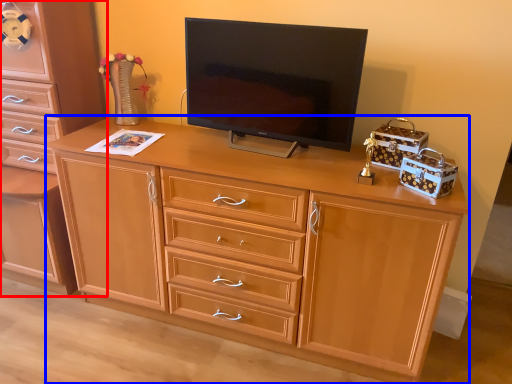
Question: Which object appears closest to the camera in this image, chest of drawers (highlighted by a red box) or desk (highlighted by a blue box)?

Choices:
 (A) chest of drawers
 (B) desk

Answer: (B)